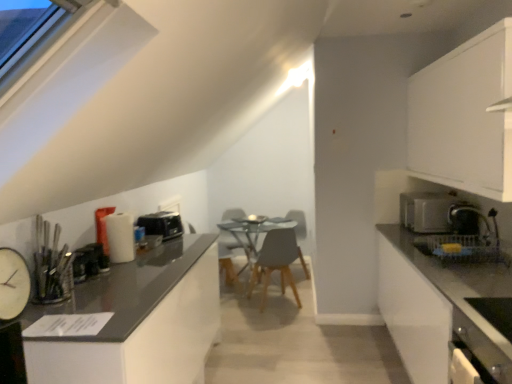
Question: Would you say satin silver toaster at right is to the left or to the right of white clock at left, the 4th appliance in the back-to-front sequence, in the picture?

Choices:
 (A) left
 (B) right

Answer: (B)

Question: Is point click(416, 210) positioned closer to the camera than point click(13, 306)?

Choices:
 (A) farther
 (B) closer

Answer: (A)

Question: Estimate the real-world distances between objects in this image. Which object is closer to the white clock at left, the 1th appliance from the left?

Choices:
 (A) satin black toaster at right, which ranks as the second appliance in back-to-front order
 (B) light gray matte chair at center
 (C) satin silver toaster at right
 (D) transparent glass table at center
 (E) metallic black toaster at left, positioned as the second appliance in left-to-right order

Answer: (E)

Question: Estimate the real-world distances between objects in this image. Which object is farther from the white clock at left, the 1th appliance from the left?

Choices:
 (A) satin black toaster at right, the 3th appliance viewed from the front
 (B) white glossy dishwasher at lower right
 (C) metallic black toaster at left, acting as the 2th appliance starting from the front
 (D) black plastic toaster at left, acting as the fourth appliance starting from the front
 (E) matte gray swivel chair at center

Answer: (E)